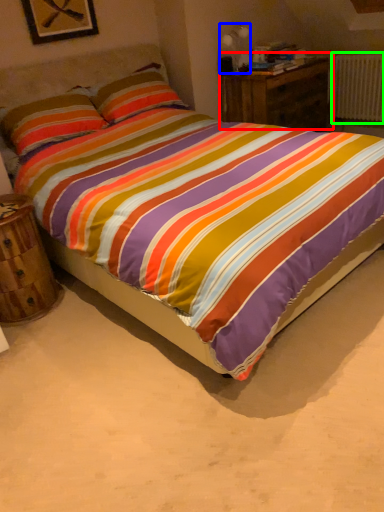
Question: Estimate the real-world distances between objects in this image. Which object is closer to nightstand (highlighted by a red box), table lamp (highlighted by a blue box) or radiator (highlighted by a green box)?

Choices:
 (A) table lamp
 (B) radiator

Answer: (A)